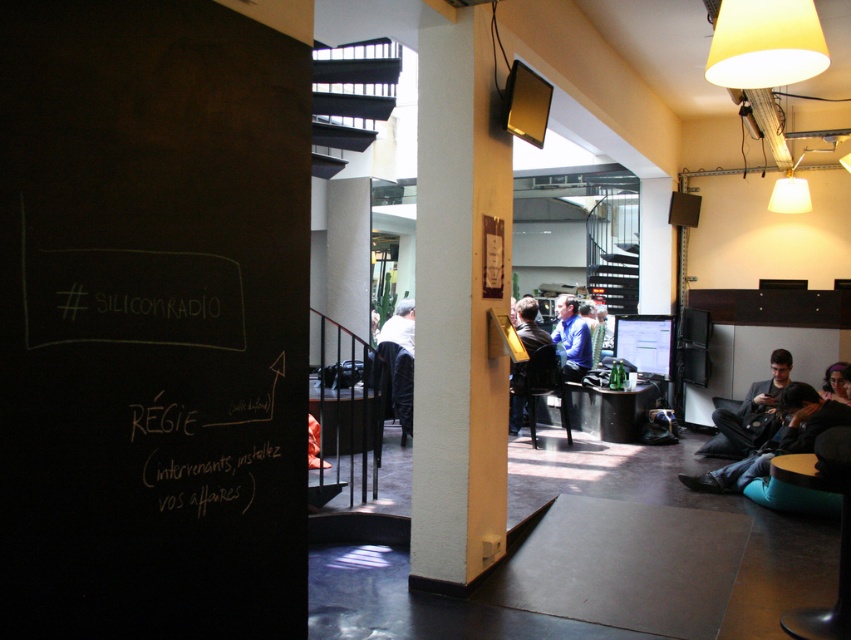
You are standing in the modern office space and want to move from the entrance to the window. There are two points marked on the floor at coordinates point (785,403) and point (568,372). Which point is closer to the entrance?

Point (785,403) is in front of point (568,372), so it is closer to the entrance.

You are standing in the office space and want to see the dark blue shirt at center without moving your head. Is the white textured pillar at center blocking your view of it?

The white textured pillar at center is in front of dark blue shirt at center, so yes, the pillar is blocking your view of the shirt.

Based on the photo, you are standing at the entrance of the office space and see two points marked on the wall. The first point is at position point [450,248] and the second is at point [761,400]. Which point is closer to you?

Point [450,248] is in front of point [761,400], so it is closer to you.